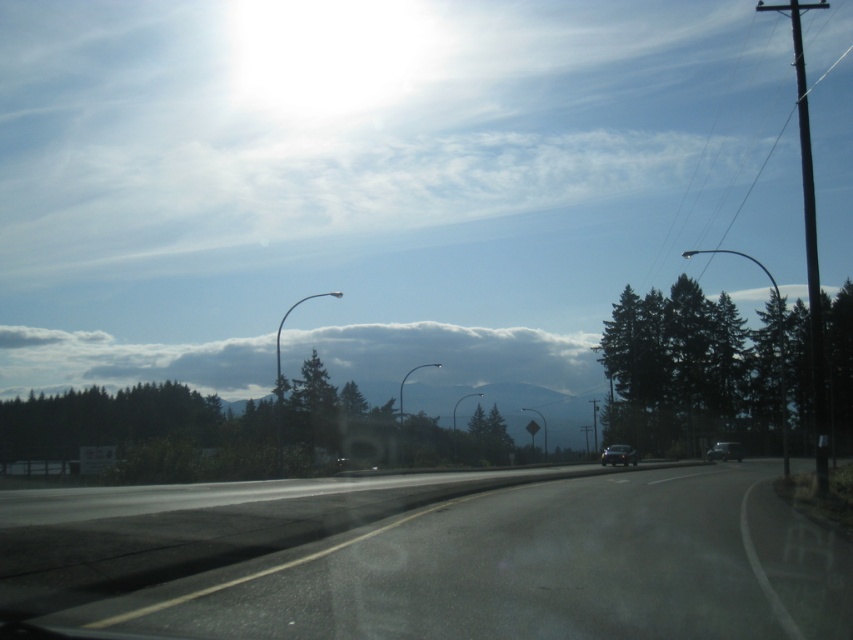
Question: Which point is closer to the camera?

Choices:
 (A) asphalt road at center
 (B) green matte tree at right

Answer: (A)

Question: Which object is the farthest from the shiny black sedan at center?

Choices:
 (A) shiny silver sedan at right
 (B) green matte tree at right

Answer: (B)

Question: Among these points, which one is nearest to the camera?

Choices:
 (A) (138, 625)
 (B) (625, 452)
 (C) (660, 314)

Answer: (A)

Question: Can you confirm if green matte tree at right is positioned to the right of shiny black sedan at center?

Choices:
 (A) yes
 (B) no

Answer: (A)

Question: Is asphalt road at center above shiny silver sedan at right?

Choices:
 (A) yes
 (B) no

Answer: (A)

Question: Does cloudy sky at center appear on the left side of shiny silver sedan at right?

Choices:
 (A) no
 (B) yes

Answer: (B)